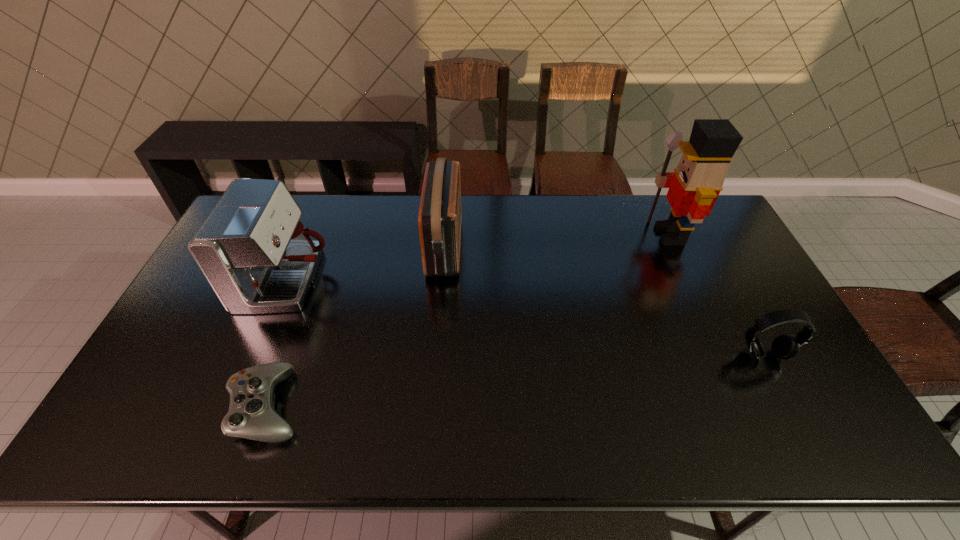
This screenshot has height=540, width=960. Find the location of `blank region between the radio receiver and the earphone`. blank region between the radio receiver and the earphone is located at coordinates (604, 300).

Image resolution: width=960 pixels, height=540 pixels. I want to click on vacant space in between the nutcracker and the nearest object, so click(x=468, y=320).

Locate an element on the screen. The image size is (960, 540). unoccupied area between the nutcracker and the coffee maker is located at coordinates (479, 258).

The image size is (960, 540). Identify the location of vacant space that's between the third object from right to left and the coffee maker. (367, 264).

The height and width of the screenshot is (540, 960). Find the location of `free space between the coffee maker and the nearest object`. free space between the coffee maker and the nearest object is located at coordinates pyautogui.click(x=278, y=343).

I want to click on object that stands as the fourth closest to the nutcracker, so click(x=251, y=415).

Identify which object is the fourth closest to the fourth tallest object. Please provide its 2D coordinates. Your answer should be formatted as a tuple, i.e. [(x, y)], where the tuple contains the x and y coordinates of a point satisfying the conditions above.

[(257, 256)]

Where is `vacant space that satisfies the following two spatial constraints: 1. on the front of the coffee maker near the spout; 2. on the right side of the control`? vacant space that satisfies the following two spatial constraints: 1. on the front of the coffee maker near the spout; 2. on the right side of the control is located at coordinates (236, 406).